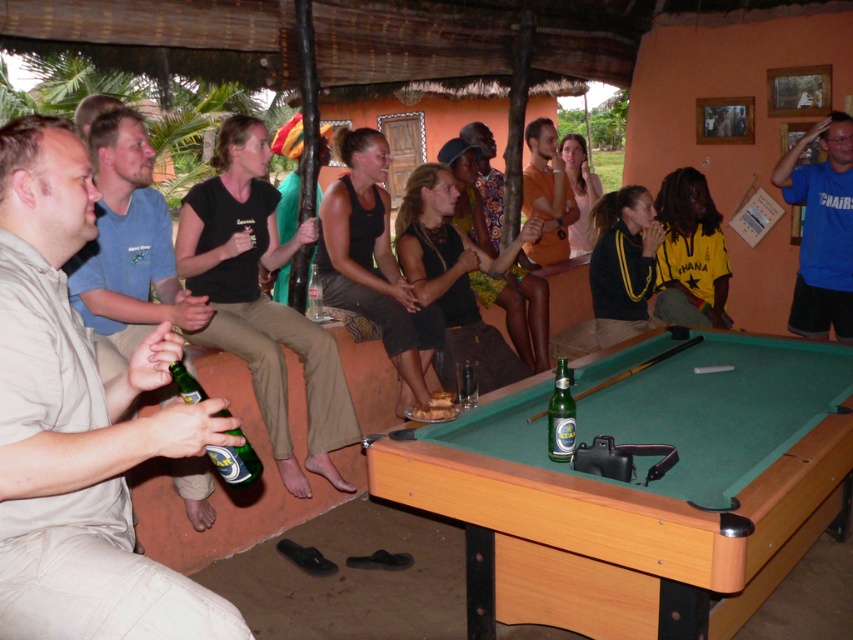
Question: Is green felt pool table at center smaller than clear glass bottle at center?

Choices:
 (A) no
 (B) yes

Answer: (A)

Question: Can you confirm if beige cotton shirt at left is smaller than clear glass bottle at center?

Choices:
 (A) no
 (B) yes

Answer: (A)

Question: Which point appears farthest from the camera in this image?

Choices:
 (A) (248, 467)
 (B) (566, 372)
 (C) (808, 248)
 (D) (593, 580)

Answer: (C)

Question: Does green felt pool table at center have a lesser width compared to green matte beer bottle at lower left?

Choices:
 (A) yes
 (B) no

Answer: (B)

Question: Which point is farther from the camera taking this photo?

Choices:
 (A) (569, 428)
 (B) (445, 490)

Answer: (A)

Question: Estimate the real-world distances between objects in this image. Which object is farther from the beige cotton shirt at left?

Choices:
 (A) green matte beer bottle at lower left
 (B) blue t-shirt at upper right
 (C) green glass bottle at center
 (D) green felt pool table at center

Answer: (B)